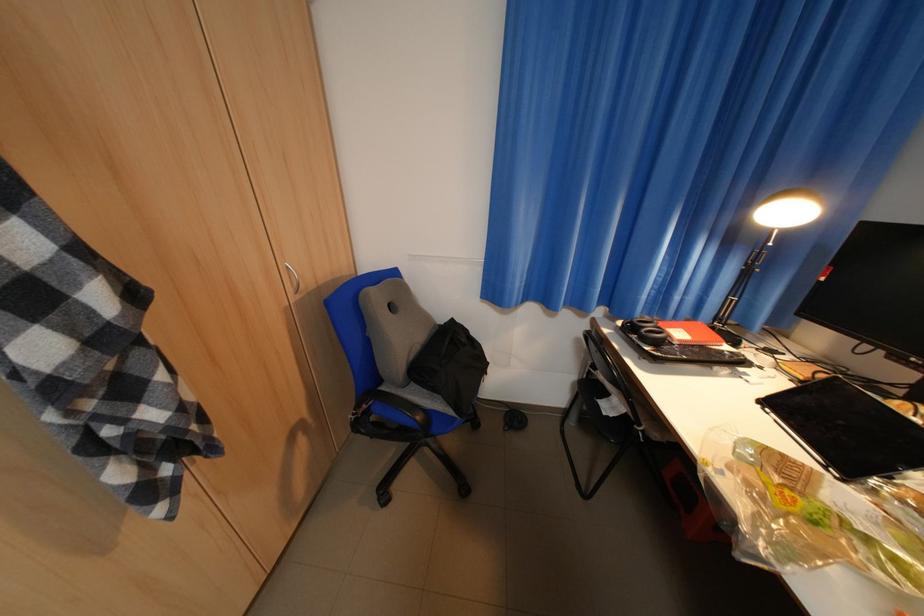
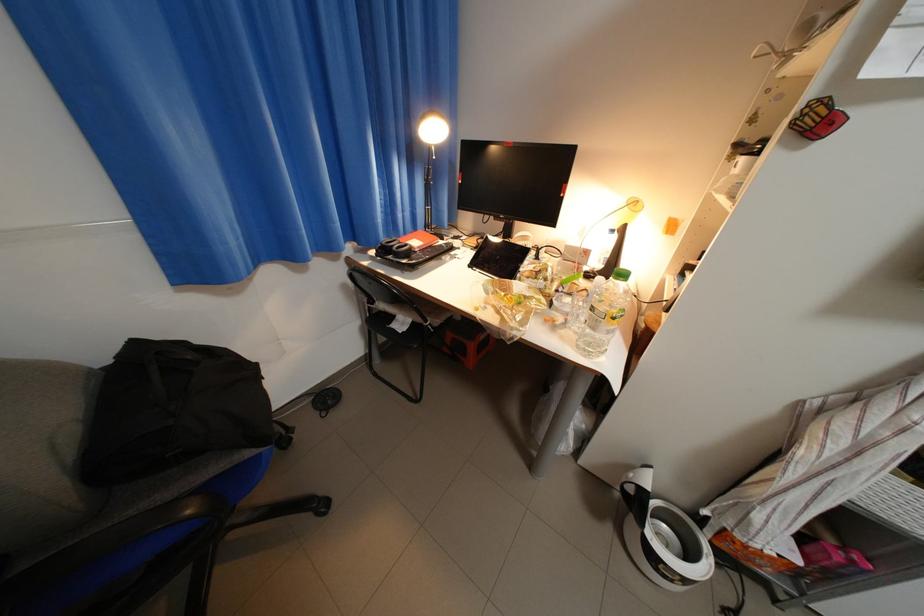
Question: I am providing you with two images of the same scene from different viewpoints. Please identify which objects are invisible in image2.

Choices:
 (A) red spiral notebook
 (B) large water bottle
 (C) black headphones
 (D) none of these

Answer: (D)